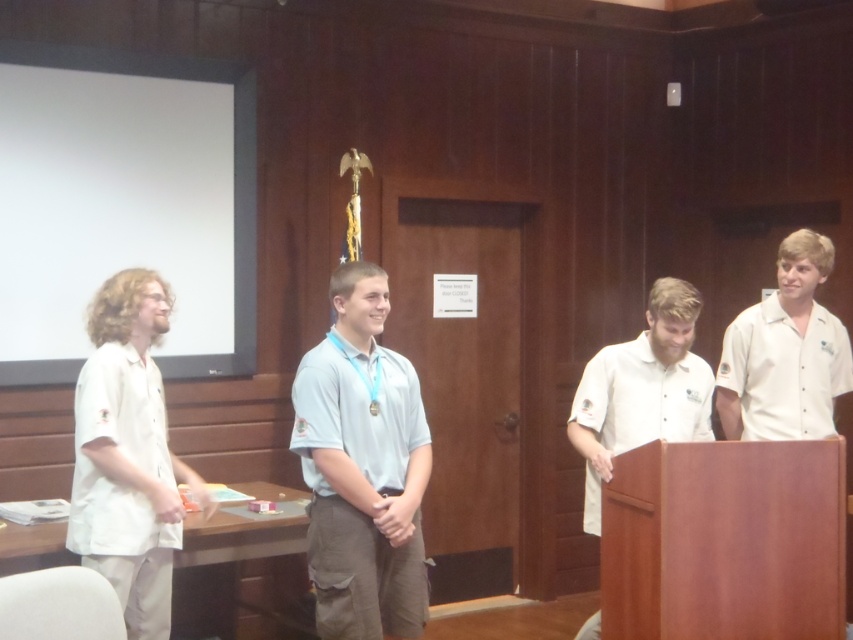
Question: Can you confirm if light blue fabric shirt at center is positioned above white matte projection screen at upper left?

Choices:
 (A) yes
 (B) no

Answer: (B)

Question: Which point is farther to the camera?

Choices:
 (A) (355, 276)
 (B) (595, 401)
 (C) (231, 64)

Answer: (C)

Question: Does light blue fabric shirt at center have a larger size compared to white cotton shirt at center?

Choices:
 (A) no
 (B) yes

Answer: (A)

Question: Can you confirm if white cotton shirt at left is positioned to the left of white cotton shirt at right?

Choices:
 (A) no
 (B) yes

Answer: (B)

Question: Considering the real-world distances, which object is farthest from the light blue fabric shirt at center?

Choices:
 (A) white cotton shirt at right
 (B) white cotton shirt at center
 (C) white matte projection screen at upper left
 (D) white cotton shirt at left

Answer: (A)

Question: Which object is positioned closest to the light blue fabric shirt at center?

Choices:
 (A) white matte projection screen at upper left
 (B) white cotton shirt at center
 (C) white cotton shirt at left
 (D) white cotton shirt at right

Answer: (C)